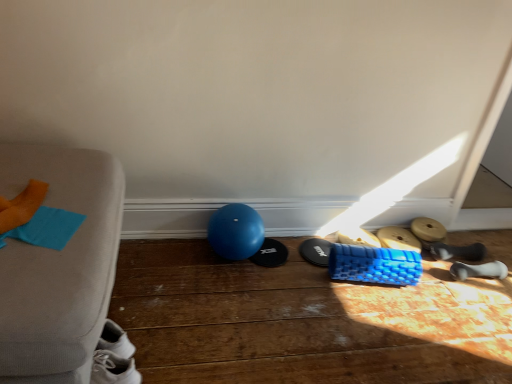
Where is `free area below blue rubber ball at center (from a real-world perspective)`? The width and height of the screenshot is (512, 384). free area below blue rubber ball at center (from a real-world perspective) is located at coordinates (234, 264).